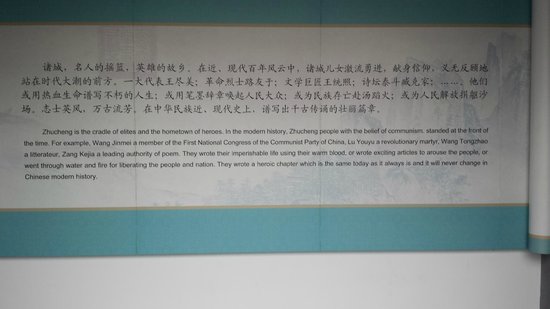
I want to click on wall, so click(346, 276).